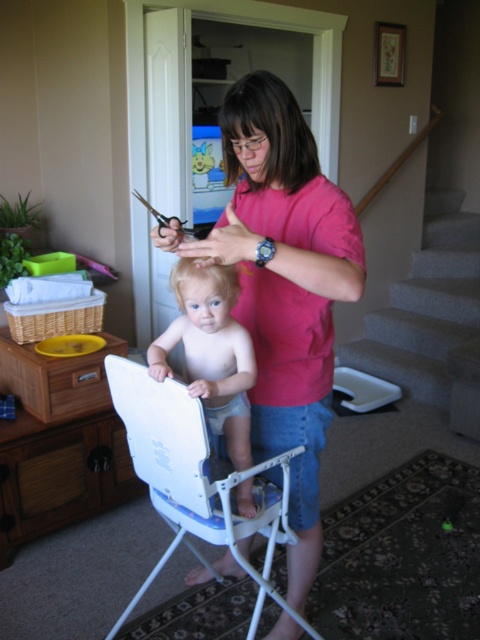
Question: Does white plastic feeding chair at center have a larger size compared to light brown plastic high chair at center?

Choices:
 (A) yes
 (B) no

Answer: (A)

Question: Is white plastic feeding chair at center wider than light brown plastic high chair at center?

Choices:
 (A) no
 (B) yes

Answer: (B)

Question: Considering the relative positions of gray carpeted stairs at lower right and light brown plastic high chair at center in the image provided, where is gray carpeted stairs at lower right located with respect to light brown plastic high chair at center?

Choices:
 (A) below
 (B) above

Answer: (B)

Question: Which object is the farthest from the gray carpeted stairs at lower right?

Choices:
 (A) pink fabric shirt at center
 (B) white plastic feeding chair at center
 (C) metallic scissors at upper center

Answer: (A)

Question: Which of the following is the farthest from the observer?

Choices:
 (A) (368, 348)
 (B) (204, 305)

Answer: (A)

Question: Among these points, which one is farthest from the camera?

Choices:
 (A) [291, 396]
 (B) [239, 428]

Answer: (A)